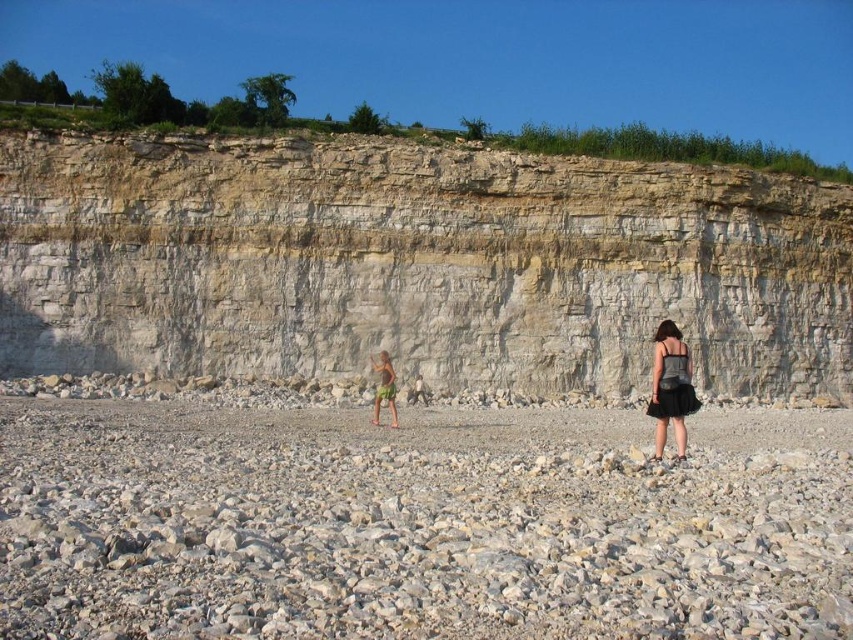
Between black tulle skirt at center and green fabric shorts at center, which one is positioned higher?

Positioned higher is black tulle skirt at center.

Which is in front, point (672, 348) or point (392, 413)?

Point (672, 348)

This screenshot has width=853, height=640. What do you see at coordinates (670, 387) in the screenshot?
I see `black tulle skirt at center` at bounding box center [670, 387].

Find the location of a particular element. The height and width of the screenshot is (640, 853). black tulle skirt at center is located at coordinates (670, 387).

Is white rock cliff at center shorter than black tulle skirt at center?

No, white rock cliff at center is not shorter than black tulle skirt at center.

Does white rock cliff at center have a greater height compared to black tulle skirt at center?

Yes.

Image resolution: width=853 pixels, height=640 pixels. In order to click on white rock cliff at center in this screenshot , I will do `click(416, 264)`.

Where is `white rock cliff at center`? The height and width of the screenshot is (640, 853). white rock cliff at center is located at coordinates (416, 264).

Can you confirm if white rock cliff at center is shorter than gray gravel beach at center?

No, white rock cliff at center is not shorter than gray gravel beach at center.

Where is `white rock cliff at center`? The width and height of the screenshot is (853, 640). white rock cliff at center is located at coordinates (416, 264).